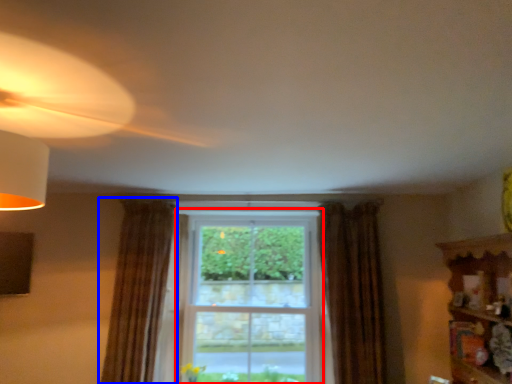
Question: Among these objects, which one is farthest to the camera, bay window (highlighted by a red box) or curtain (highlighted by a blue box)?

Choices:
 (A) bay window
 (B) curtain

Answer: (A)